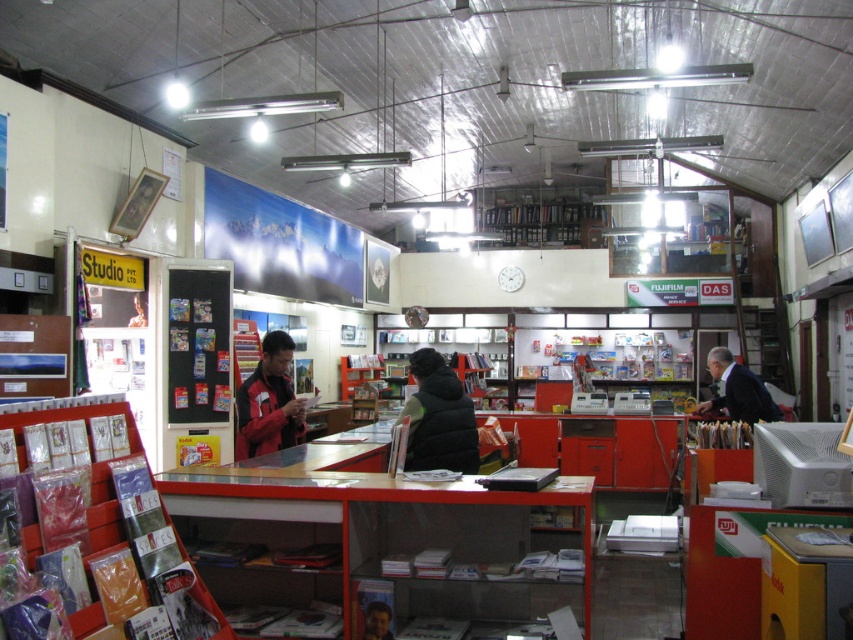
Does red jacket at center appear on the left side of smooth skin face at center?

Yes, red jacket at center is to the left of smooth skin face at center.

The width and height of the screenshot is (853, 640). What are the coordinates of `red jacket at center` in the screenshot? It's located at (270, 401).

Can you confirm if black fuzzy jacket at center is taller than red jacket at center?

No.

Where is `black fuzzy jacket at center`? Image resolution: width=853 pixels, height=640 pixels. black fuzzy jacket at center is located at coordinates (438, 417).

Where is `black fuzzy jacket at center`? The height and width of the screenshot is (640, 853). black fuzzy jacket at center is located at coordinates (438, 417).

Which is more to the left, red jacket at center or dark suit at right?

From the viewer's perspective, red jacket at center appears more on the left side.

Between point (258, 362) and point (741, 380), which one is positioned behind?

The point (258, 362) is more distant.

Locate an element on the screen. The width and height of the screenshot is (853, 640). red jacket at center is located at coordinates (270, 401).